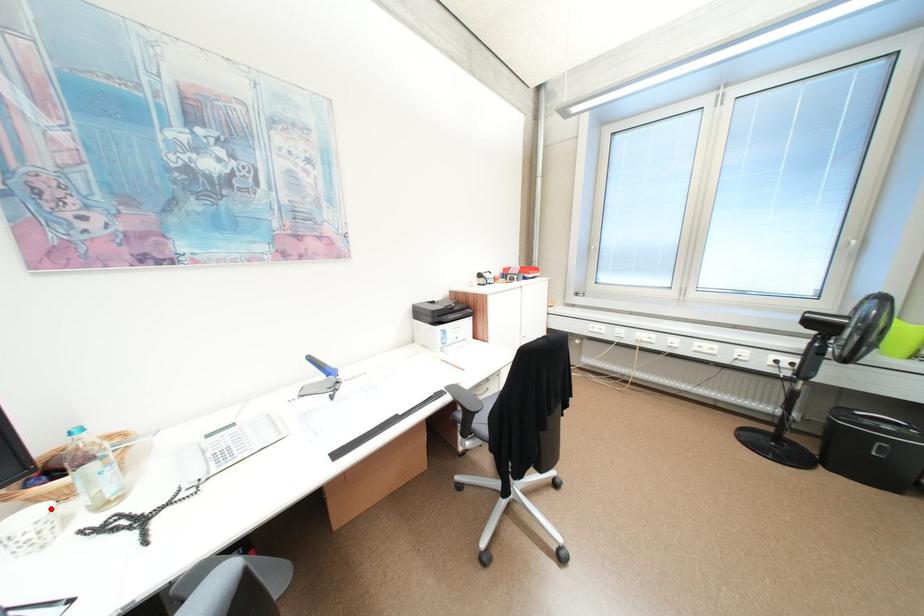
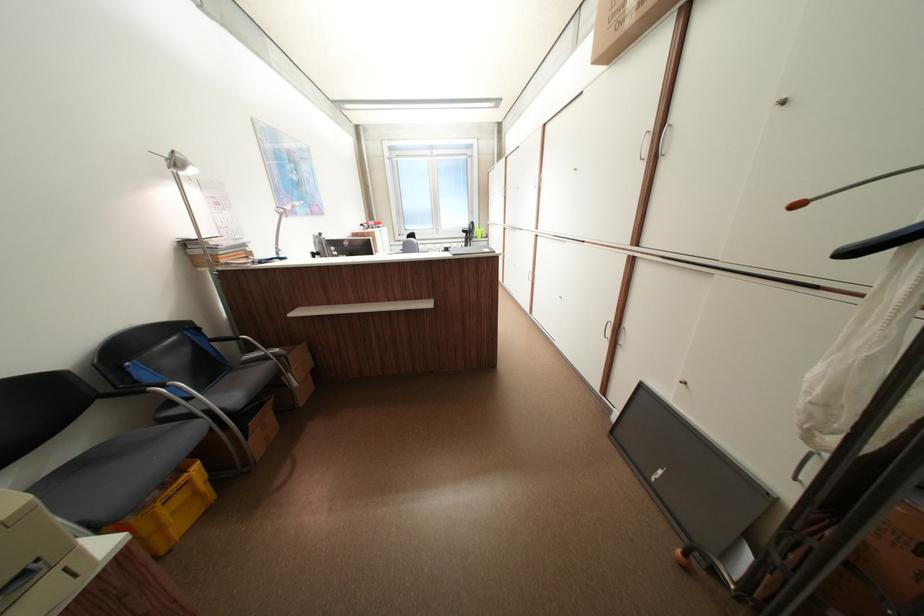
Question: I am providing you with two images of the same scene from different viewpoints. A red point is marked on the first image. At the location where the point appears in image 1, is it still visible in image 2?

Choices:
 (A) Yes
 (B) No

Answer: (B)